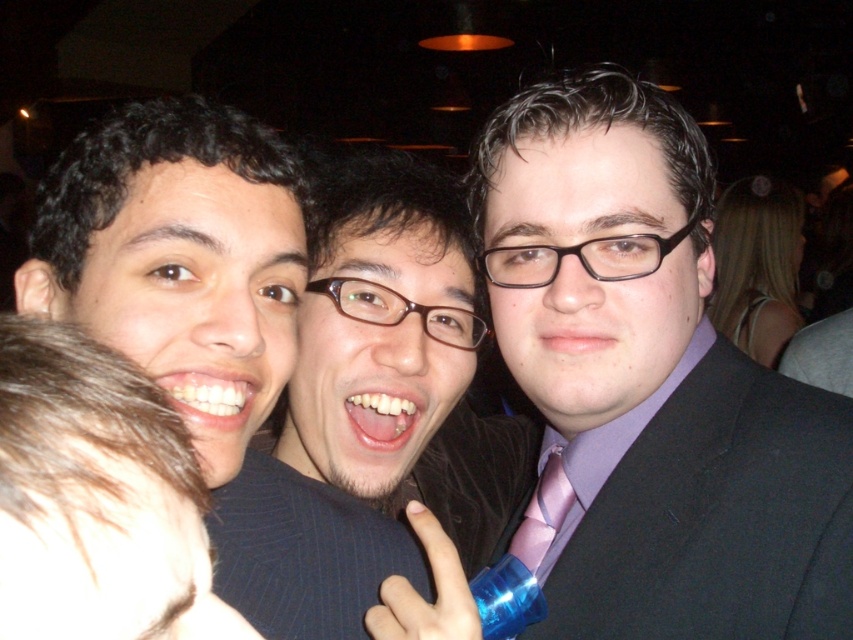
Question: Which object is closer to the camera taking this photo?

Choices:
 (A) matte black suit at center
 (B) brown pinstriped suit at center
 (C) purple satin tie at center

Answer: (A)

Question: Which of the following is the farthest from the observer?

Choices:
 (A) brown pinstriped suit at center
 (B) matte black suit at center
 (C) dark gray suit at right
 (D) matte black hair at left

Answer: (C)

Question: Which point appears closest to the camera in this image?

Choices:
 (A) (491, 470)
 (B) (173, 360)
 (C) (555, 483)
 (D) (730, 608)

Answer: (B)

Question: Is brown pinstriped suit at center below purple satin tie at center?

Choices:
 (A) yes
 (B) no

Answer: (B)

Question: Is matte black suit at center below dark gray suit at right?

Choices:
 (A) no
 (B) yes

Answer: (A)

Question: Does brown pinstriped suit at center have a lesser width compared to matte black hair at left?

Choices:
 (A) yes
 (B) no

Answer: (B)